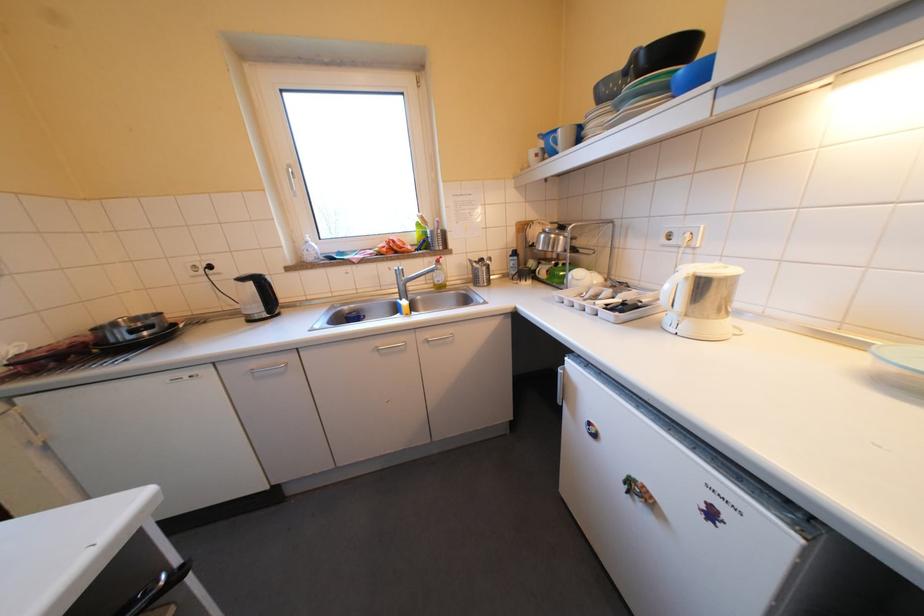
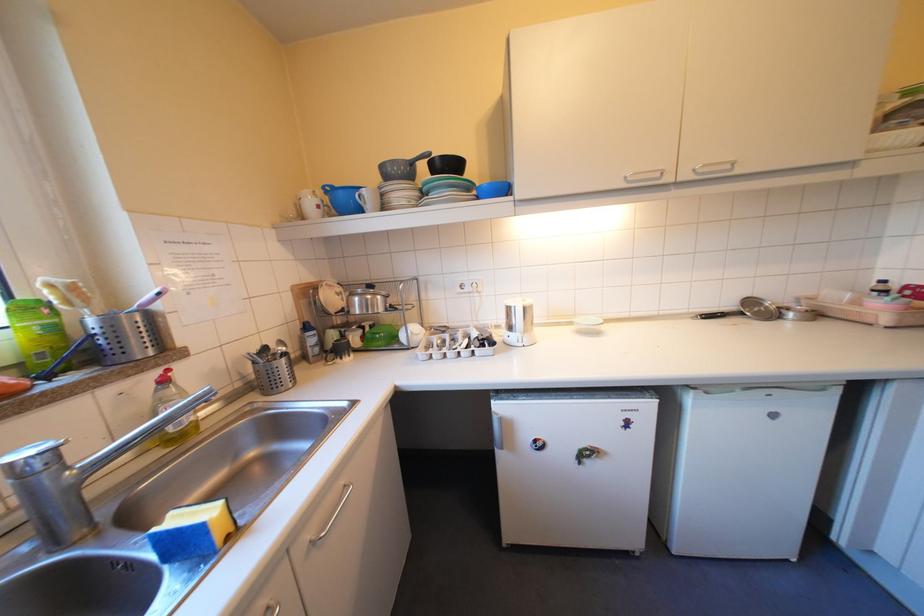
Locate, in the second image, the point that corresponds to point (570, 152) in the first image.

(373, 209)